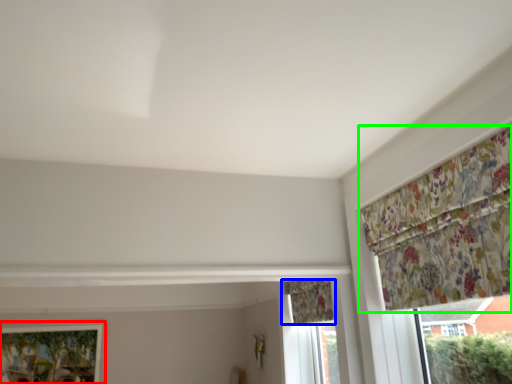
Question: Considering the real-world distances, which object is closest to window (highlighted by a red box)? curtain (highlighted by a blue box) or curtain (highlighted by a green box).

Choices:
 (A) curtain
 (B) curtain

Answer: (A)